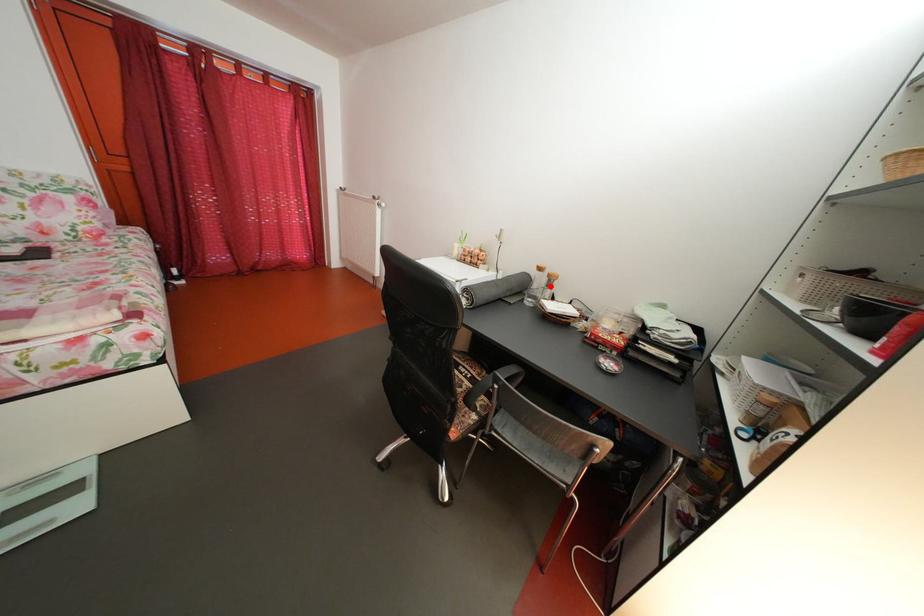
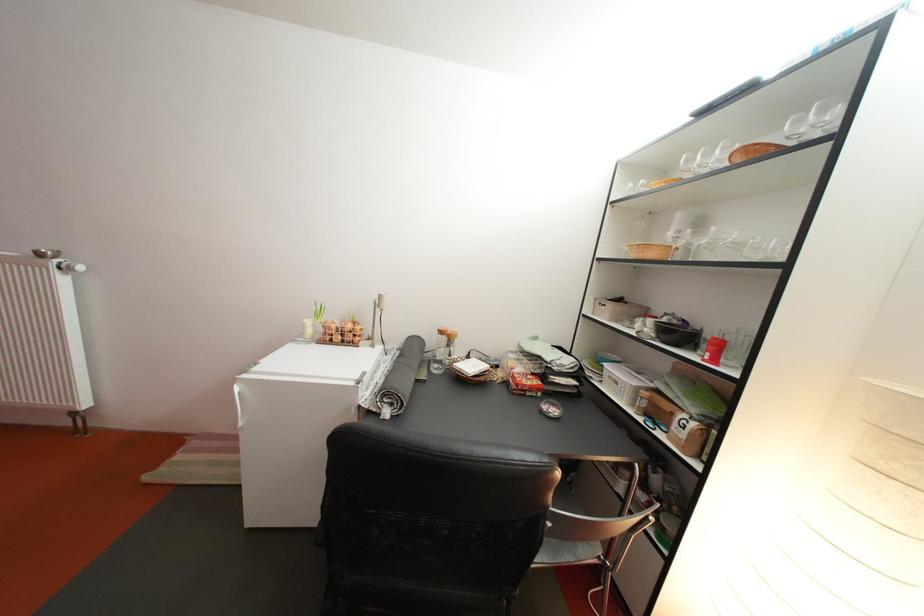
Question: I am providing you with two images of the same scene from different viewpoints. Given a red point in image1, look at the same physical point in image2. Is it:

Choices:
 (A) Closer to the viewpoint
 (B) Farther from the viewpoint

Answer: (B)